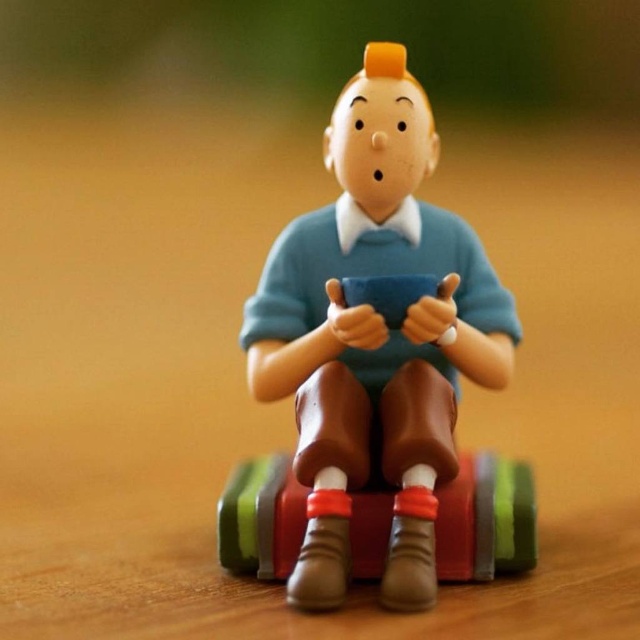
Question: Is matte plastic figure at center to the left of rubberized plastic suitcase at center from the viewer's perspective?

Choices:
 (A) yes
 (B) no

Answer: (B)

Question: Can you confirm if matte plastic figure at center is thinner than rubberized plastic suitcase at center?

Choices:
 (A) yes
 (B) no

Answer: (A)

Question: Does matte plastic figure at center appear on the left side of rubberized plastic suitcase at center?

Choices:
 (A) yes
 (B) no

Answer: (B)

Question: Which of the following is the closest to the observer?

Choices:
 (A) (524, 474)
 (B) (417, 310)

Answer: (B)

Question: Which object is closer to the camera taking this photo?

Choices:
 (A) rubberized plastic suitcase at center
 (B) matte plastic figure at center

Answer: (B)

Question: Which point is farther from the camera taking this photo?

Choices:
 (A) (461, 490)
 (B) (340, 368)

Answer: (A)